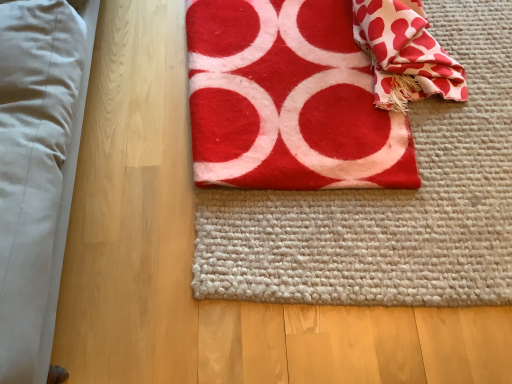
Image resolution: width=512 pixels, height=384 pixels. In order to click on empty space that is ontop of red felt yoga mat at center (from a real-world perspective) in this screenshot , I will do `click(307, 94)`.